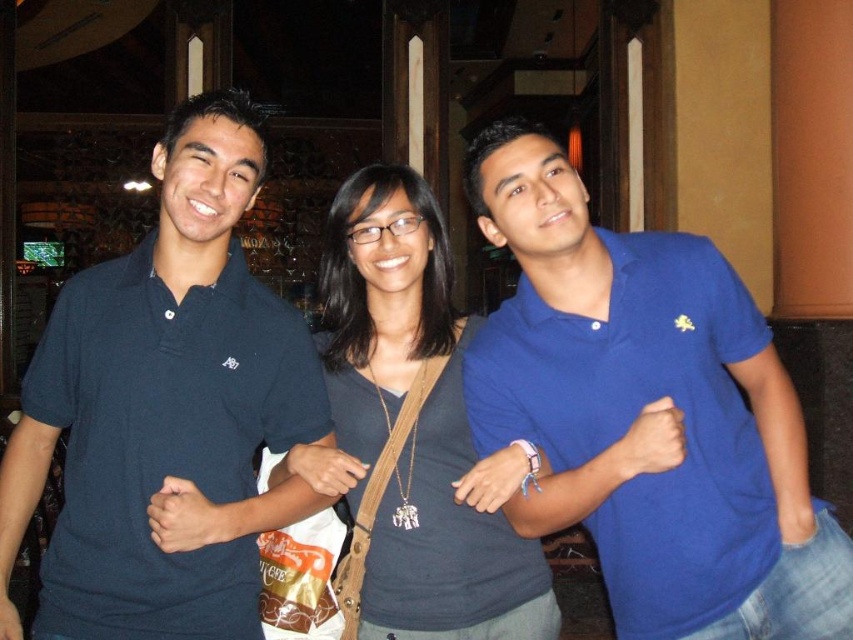
You are a photographer trying to adjust the lighting for a group photo. You need to ensure that both the dark blue polo shirt at left and the matte gray shirt at center are well lit. Given their positions, which shirt should you focus the light on first to ensure proper exposure?

The dark blue polo shirt at left is positioned under matte gray shirt at center, so you should focus the light on the matte gray shirt at center first to ensure it receives adequate illumination before the lower positioned dark blue polo shirt at left.

Looking at this image, you are standing at the entrance of the venue and want to take a photo of the blue cotton polo shirt at center and the matte gray shirt at center. Given that your camera has a maximum focus range of 5 meters, will both subjects be in focus if they remain in their current positions?

The blue cotton polo shirt at center and the matte gray shirt at center are 5.05 meters apart from each other. Since the camera can only focus up to 5 meters, the distance between them exceeds the focus range. Therefore, both subjects cannot be in focus simultaneously.